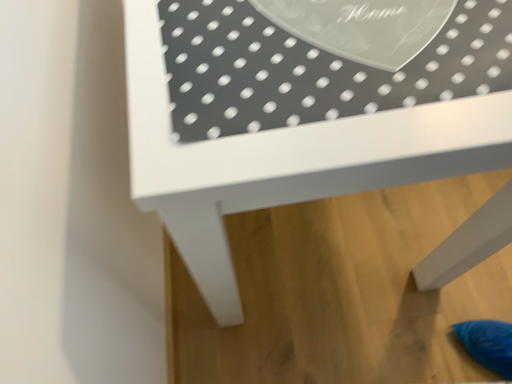
What do you see at coordinates (305, 108) in the screenshot? I see `white glossy table at upper center` at bounding box center [305, 108].

The width and height of the screenshot is (512, 384). Identify the location of white glossy table at upper center. (305, 108).

Locate an element on the screen. This screenshot has height=384, width=512. white glossy table at upper center is located at coordinates point(305,108).